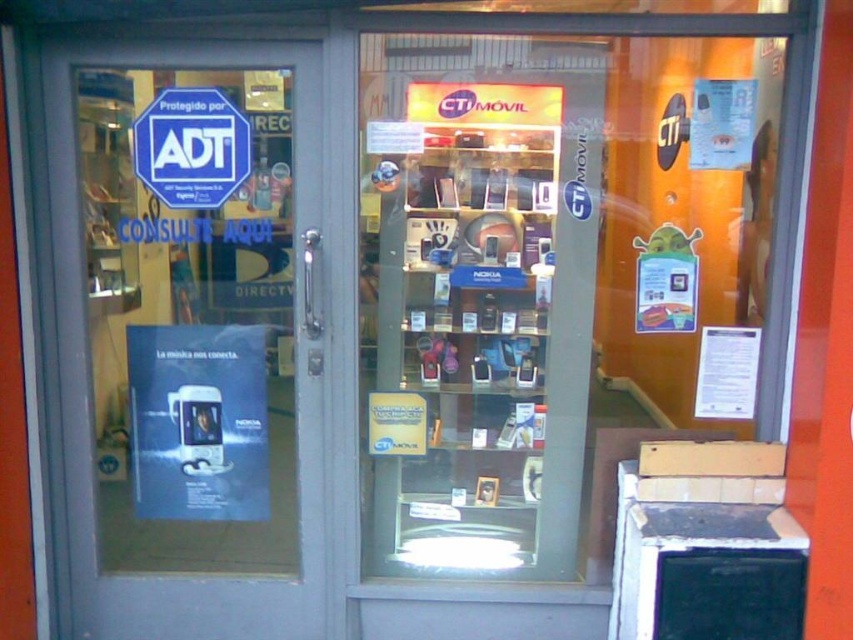
Is point (131, 349) closer to viewer compared to point (175, 118)?

No, it is behind (175, 118).

Between point (82, 380) and point (178, 170), which one is positioned behind?

Point (82, 380)

This screenshot has height=640, width=853. Find the location of `gray glass door at left`. gray glass door at left is located at coordinates (190, 336).